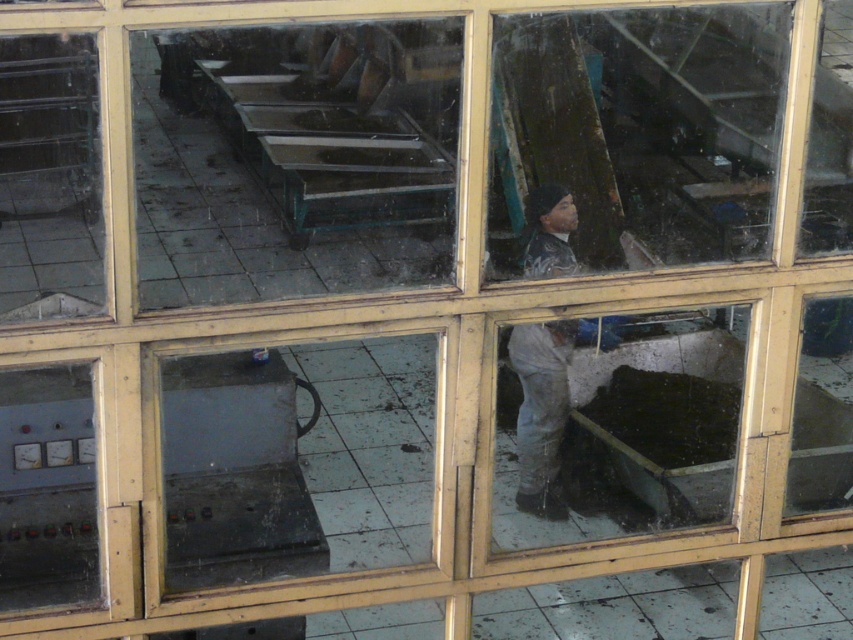
You are standing in the control room and see two points marked on the glass panels. The first point is at coordinates point (431, 60) and the second is at point (556, 499). Which point is closer to you?

Point (431, 60) is behind point (556, 499), so the point closer to you is point (556, 499).

You are a maintenance technician in the control room. You need to inspect both the transparent glass table at upper left and the gray fabric worker at center. Which object is closer to you?

The transparent glass table at upper left is closer to you because it is further to the viewer than the gray fabric worker at center.

You are standing in the control room and need to place a heavy tool on the transparent glass table at upper left without it falling off. Considering the gray fabric worker at center is in the way, how can you ensure the tool stays on the table?

The transparent glass table at upper left is located above the gray fabric worker at center, so placing the heavy tool on the table ensures it stays on the table and does not fall onto the worker below.